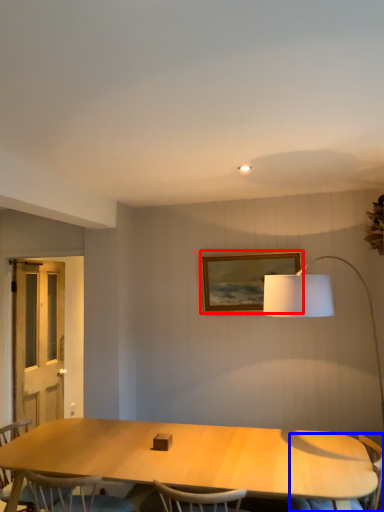
Question: Which object appears farthest to the camera in this image, picture frame (highlighted by a red box) or armchair (highlighted by a blue box)?

Choices:
 (A) picture frame
 (B) armchair

Answer: (A)